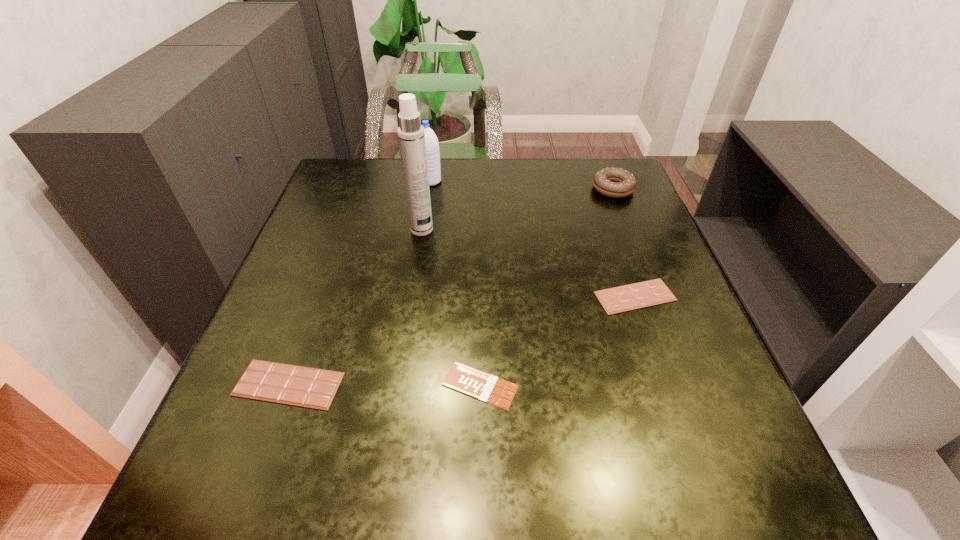
Where is `the fourth nearest object`? the fourth nearest object is located at coordinates (411, 136).

At what (x,y) coordinates should I click in order to perform the action: click on aerosol can. Please return your answer as a coordinate pair (x, y). Looking at the image, I should click on (411, 136).

Identify the location of water bottle. (431, 141).

The width and height of the screenshot is (960, 540). I want to click on doughnut, so click(613, 182).

This screenshot has height=540, width=960. I want to click on the leftmost object, so click(301, 386).

Where is `the fourth farthest object`? The height and width of the screenshot is (540, 960). the fourth farthest object is located at coordinates (620, 299).

Find the location of `the farthest chocolate bar`. the farthest chocolate bar is located at coordinates (620, 299).

Locate an element on the screen. The image size is (960, 540). the shortest chocolate bar is located at coordinates (470, 381).

At what (x,y) coordinates should I click in order to perform the action: click on the shortest object. Please return your answer as a coordinate pair (x, y). This screenshot has height=540, width=960. Looking at the image, I should click on (470, 381).

Where is `free space located on the right of the third farthest object`? free space located on the right of the third farthest object is located at coordinates (569, 230).